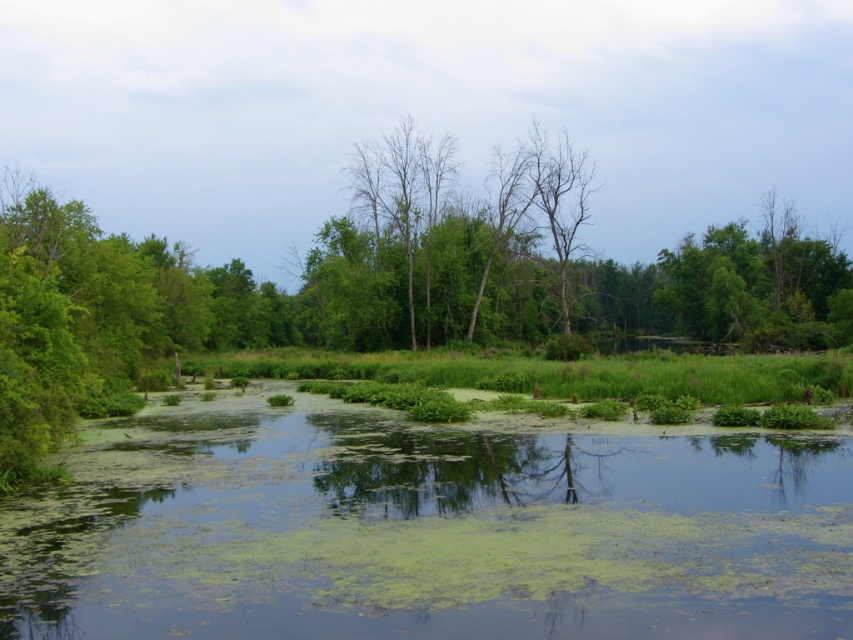
Which is above, green algae-covered water at center or bare branches at center?

bare branches at center is higher up.

Does green algae-covered water at center have a lesser height compared to bare branches at center?

Yes.

Who is more distant from viewer, (22, 499) or (440, 156)?

Positioned behind is point (440, 156).

Image resolution: width=853 pixels, height=640 pixels. I want to click on green algae-covered water at center, so click(x=424, y=529).